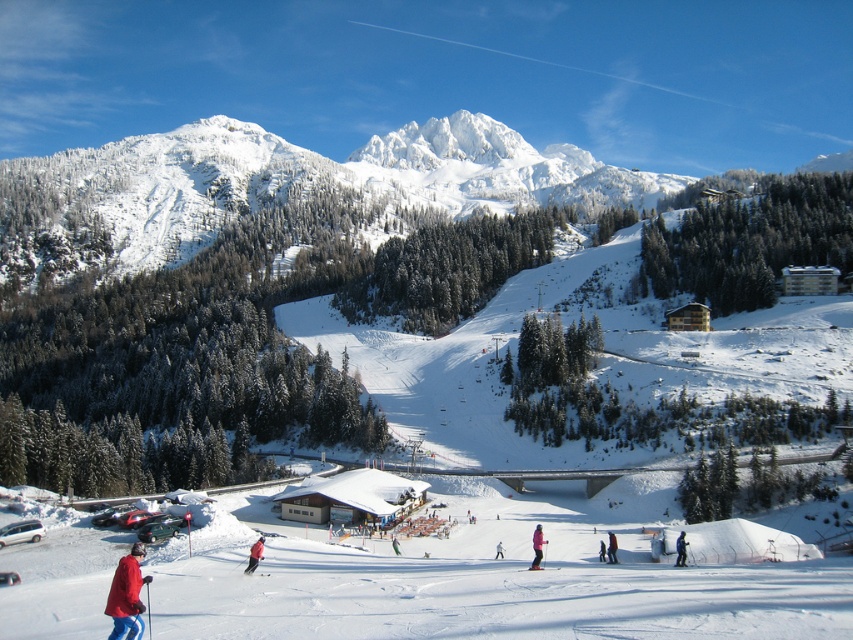
You are a photographer standing at the edge of the ski slope. You want to capture a photo that includes both the matte pink jacket at lower center and the white matte skier at center. Based on their positions, which object should you adjust your camera angle to focus on first to ensure both are in frame?

The matte pink jacket at lower center is positioned on the left side of the white matte skier at center. To ensure both are in frame, you should first focus on the matte pink jacket at lower center since it is on the left, then adjust to include the white matte skier at center.

You are planning to take a photo of the matte red jacket at lower left and the matte red ski at center. Since you want both objects to appear the same size in the photo, which object should you move closer to the camera?

The matte red ski at center should be moved closer to the camera because the matte red jacket at lower left is wider than the matte red ski at center, so to make them appear the same size in the photo, the smaller object, the matte red ski at center, needs to be positioned closer to the camera.

You are a ski instructor standing at the top of the slope. You see the red jacket at center and the white matte skier at center. If you want to give instructions to both, which one is closer to you?

Both the red jacket at center and the white matte skier at center are at the same distance from you since they are both positioned at the center of the scene.